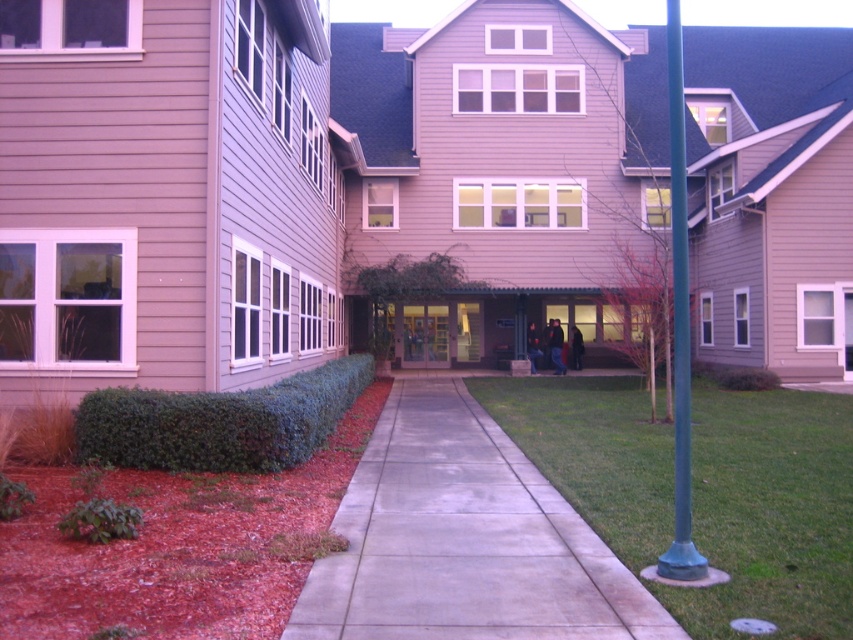
Is green leafy hedge at lower left shorter than green metallic pole at right?

Yes.

Can you confirm if green leafy hedge at lower left is wider than green metallic pole at right?

No.

This screenshot has width=853, height=640. What do you see at coordinates (219, 420) in the screenshot?
I see `green leafy hedge at lower left` at bounding box center [219, 420].

Locate an element on the screen. The width and height of the screenshot is (853, 640). green leafy hedge at lower left is located at coordinates (219, 420).

Between point (798, 499) and point (155, 396), which one is positioned in front?

Point (798, 499) is in front.

Between green grass at center and green leafy hedge at lower left, which one has less height?

green grass at center is shorter.

Between point (677, 612) and point (299, 400), which one is positioned behind?

Point (299, 400)

This screenshot has height=640, width=853. Identify the location of green grass at center. (770, 513).

Is green grass at center taller than green metallic pole at right?

No, green grass at center is not taller than green metallic pole at right.

Is green grass at center smaller than green metallic pole at right?

Yes, green grass at center is smaller than green metallic pole at right.

Consider the image. Who is more forward, (766, 593) or (671, 168)?

Positioned in front is point (766, 593).

Locate an element on the screen. green grass at center is located at coordinates (770, 513).